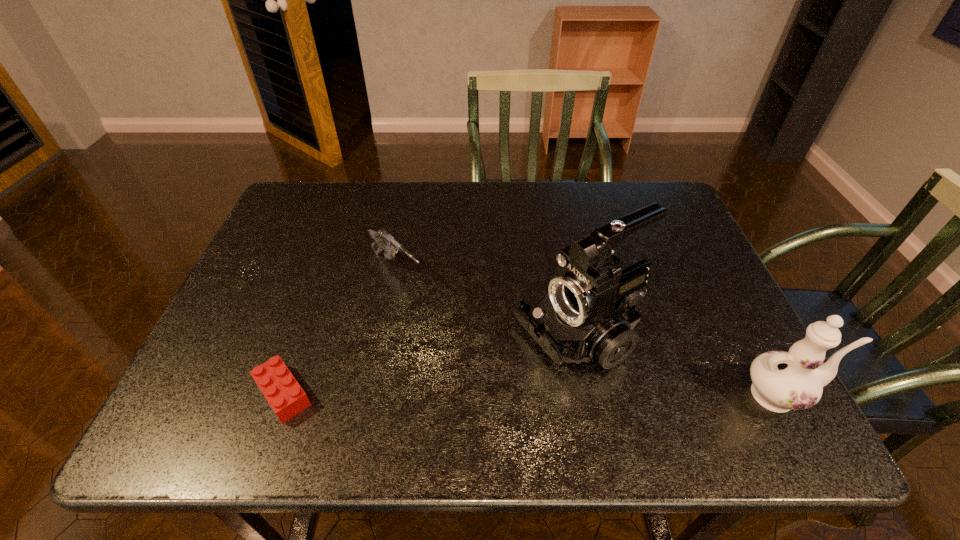
Image resolution: width=960 pixels, height=540 pixels. In order to click on free area in between the chinaware and the leftmost object in this screenshot , I will do `click(532, 395)`.

At what (x,y) coordinates should I click in order to perform the action: click on free space between the rightmost object and the leftmost object. Please return your answer as a coordinate pair (x, y). This screenshot has width=960, height=540. Looking at the image, I should click on (532, 395).

Locate an element on the screen. This screenshot has width=960, height=540. vacant area that lies between the leftmost object and the gun is located at coordinates (340, 332).

At what (x,y) coordinates should I click in order to perform the action: click on free spot between the chinaware and the tallest object. Please return your answer as a coordinate pair (x, y). The width and height of the screenshot is (960, 540). Looking at the image, I should click on (678, 365).

At what (x,y) coordinates should I click in order to perform the action: click on vacant point located between the camcorder and the Lego. Please return your answer as a coordinate pair (x, y). The image size is (960, 540). Looking at the image, I should click on (429, 364).

Locate an element on the screen. This screenshot has height=540, width=960. free space between the leftmost object and the third shortest object is located at coordinates [x=532, y=395].

Find the location of a particular element. The image size is (960, 540). vacant area between the third object from right to left and the shortest object is located at coordinates (340, 332).

Find the location of a particular element. the closest object to the tallest object is located at coordinates (782, 381).

At what (x,y) coordinates should I click in order to perform the action: click on object that stands as the second closest to the second object from left to right. Please return your answer as a coordinate pair (x, y). The image size is (960, 540). Looking at the image, I should click on (588, 313).

In order to click on free space that satisfies the following two spatial constraints: 1. on the front side of the third shortest object; 2. at the spout of the gun in this screenshot , I will do (372, 395).